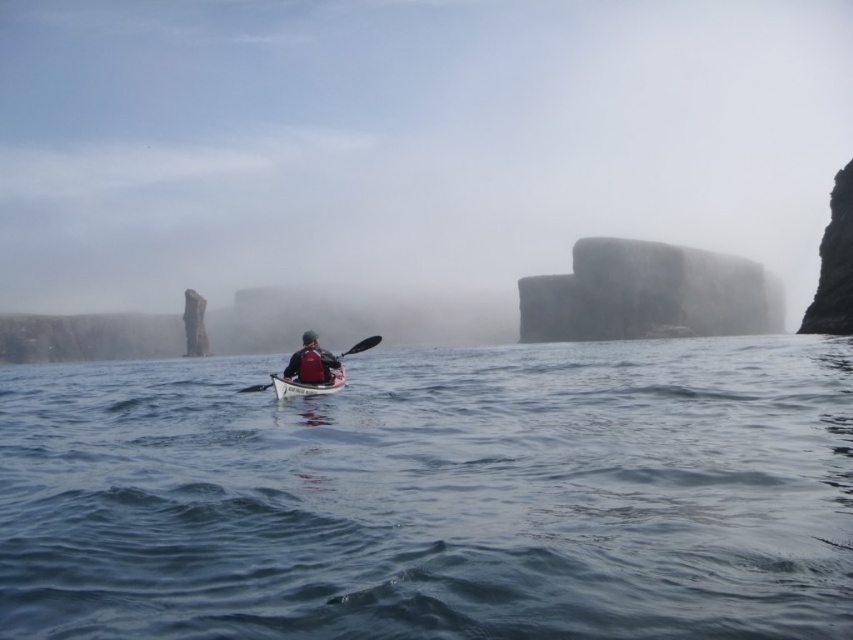
Between point (755, 384) and point (312, 371), which one is positioned behind?

The point (755, 384) is behind.

Can you confirm if blue water at center is thinner than matte red life vest at center?

No.

Is point (212, 528) closer to camera compared to point (288, 364)?

Yes.

Where is `blue water at center`? This screenshot has width=853, height=640. blue water at center is located at coordinates tap(436, 496).

Can you confirm if blue water at center is bigger than matte white canoe at center?

Correct, blue water at center is larger in size than matte white canoe at center.

Is point (125, 481) farther from camera compared to point (341, 376)?

No, (125, 481) is in front of (341, 376).

Is point (554, 426) more distant than point (329, 392)?

No, (554, 426) is closer to viewer.

You are a GUI agent. You are given a task and a screenshot of the screen. Output one action in this format:
    pyautogui.click(x=<x>, y=<y>)
    Task: Click on the blue water at center
    This screenshot has width=853, height=640.
    Given the screenshot: What is the action you would take?
    pyautogui.click(x=436, y=496)

Who is positioned more to the left, matte red life vest at center or black plastic paddle at center?

black plastic paddle at center is more to the left.

The image size is (853, 640). I want to click on matte red life vest at center, so click(310, 362).